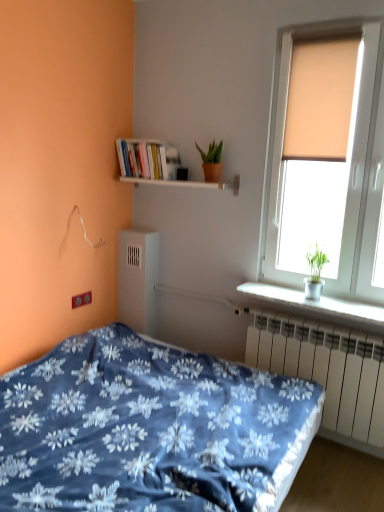
Question: From a real-world perspective, is matte beige window at upper right on hardcover books at upper left?

Choices:
 (A) no
 (B) yes

Answer: (A)

Question: Is matte beige window at upper right taller than hardcover books at upper left?

Choices:
 (A) yes
 (B) no

Answer: (A)

Question: Is hardcover books at upper left inside matte beige window at upper right?

Choices:
 (A) yes
 (B) no

Answer: (B)

Question: Is matte beige window at upper right positioned in front of hardcover books at upper left?

Choices:
 (A) yes
 (B) no

Answer: (A)

Question: Is matte beige window at upper right smaller than hardcover books at upper left?

Choices:
 (A) no
 (B) yes

Answer: (A)

Question: Would you say white wooden shelf at upper center, positioned as the first window sill in top-to-bottom order, is to the left or to the right of blue floral fabric bed at lower left in the picture?

Choices:
 (A) right
 (B) left

Answer: (A)

Question: Considering the positions of white wooden shelf at upper center, marked as the second window sill in a right-to-left arrangement, and blue floral fabric bed at lower left in the image, is white wooden shelf at upper center, marked as the second window sill in a right-to-left arrangement, bigger or smaller than blue floral fabric bed at lower left?

Choices:
 (A) small
 (B) big

Answer: (A)

Question: In terms of width, does white wooden shelf at upper center, arranged as the 2th window sill when ordered from the bottom, look wider or thinner when compared to blue floral fabric bed at lower left?

Choices:
 (A) thin
 (B) wide

Answer: (A)

Question: From a real-world perspective, relative to blue floral fabric bed at lower left, is white wooden shelf at upper center, marked as the second window sill in a right-to-left arrangement, vertically above or below?

Choices:
 (A) above
 (B) below

Answer: (A)

Question: Is beige fabric curtain at upper right inside the boundaries of white metallic radiator at lower right, or outside?

Choices:
 (A) inside
 (B) outside

Answer: (B)

Question: In the image, is beige fabric curtain at upper right on the left side or the right side of white metallic radiator at lower right?

Choices:
 (A) left
 (B) right

Answer: (A)

Question: From a real-world perspective, is beige fabric curtain at upper right positioned above or below white metallic radiator at lower right?

Choices:
 (A) below
 (B) above

Answer: (B)

Question: From the image's perspective, relative to white metallic radiator at lower right, is beige fabric curtain at upper right above or below?

Choices:
 (A) below
 (B) above

Answer: (B)

Question: From a real-world perspective, is white metallic radiator at lower right above or below beige fabric curtain at upper right?

Choices:
 (A) below
 (B) above

Answer: (A)

Question: Looking at their shapes, would you say white metallic radiator at lower right is wider or thinner than beige fabric curtain at upper right?

Choices:
 (A) thin
 (B) wide

Answer: (A)